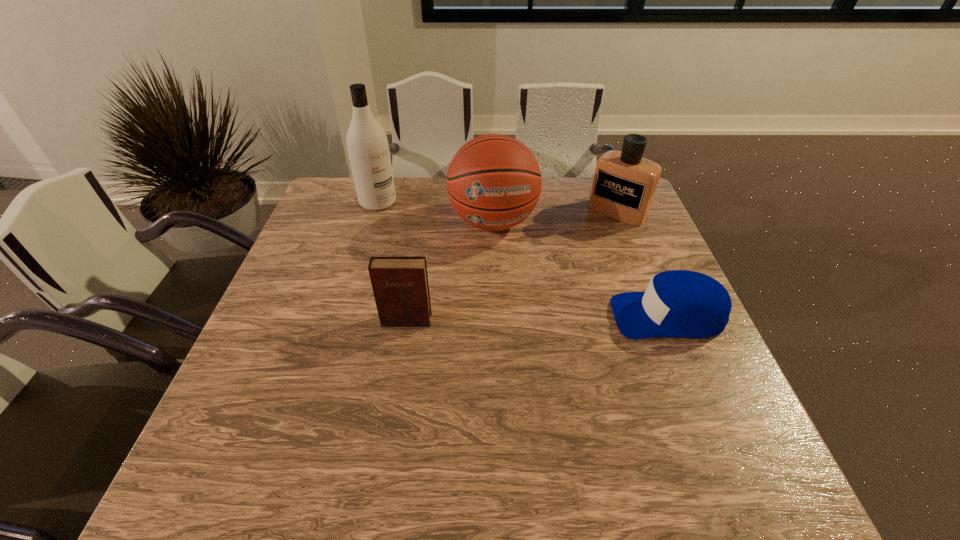
Find the location of a particular element. This screenshot has width=960, height=540. vacant space at the left edge of the desktop is located at coordinates (309, 339).

The height and width of the screenshot is (540, 960). In the image, there is a desktop. Find the location of `vacant space at the right edge`. vacant space at the right edge is located at coordinates (652, 340).

Image resolution: width=960 pixels, height=540 pixels. In order to click on vacant space at the near left corner of the desktop in this screenshot , I will do `click(289, 403)`.

Image resolution: width=960 pixels, height=540 pixels. I want to click on blank region between the basketball and the leftmost object, so click(x=436, y=212).

Locate an element on the screen. This screenshot has width=960, height=540. free space between the baseball cap and the second shortest object is located at coordinates [x=537, y=318].

At what (x,y) coordinates should I click in order to perform the action: click on free space between the perfume and the shortest object. Please return your answer as a coordinate pair (x, y). The width and height of the screenshot is (960, 540). Looking at the image, I should click on (642, 264).

Locate an element on the screen. free spot between the basketball and the tallest object is located at coordinates (436, 212).

At what (x,y) coordinates should I click in order to perform the action: click on vacant space that's between the perfume and the fourth tallest object. Please return your answer as a coordinate pair (x, y). Looking at the image, I should click on (512, 266).

Identify the location of free spot between the fourth object from right to left and the perfume. (512, 266).

I want to click on vacant point located between the leftmost object and the shortest object, so click(x=523, y=259).